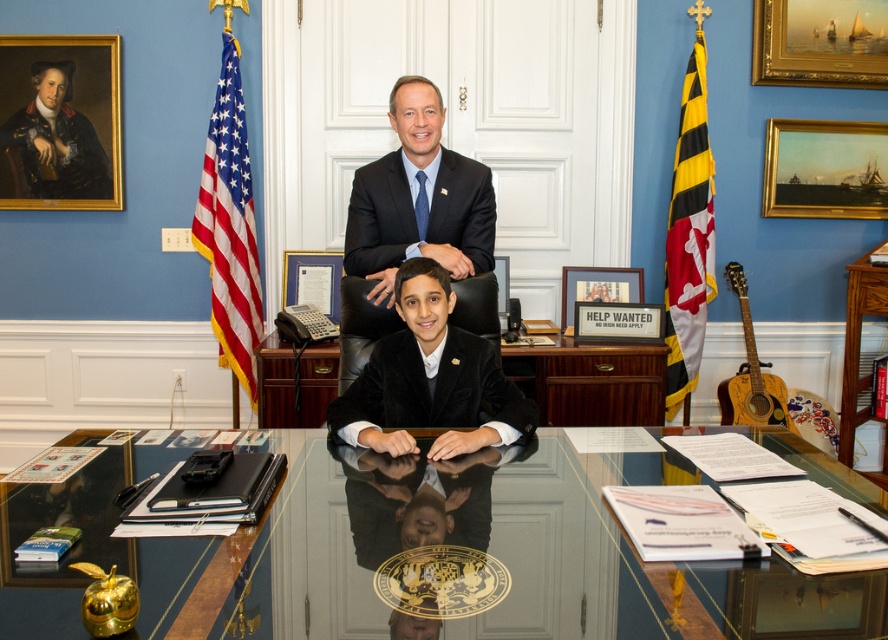
You are standing in the office shown in the image. If you want to place a new document on the glossy glass table at center, where exactly should you aim? Please provide the coordinates from the scene description.

The glossy glass table at center is located at coordinates point (x=401, y=550), so you should aim for that exact point to place the new document there.

You are an interior designer planning to place a new piece of furniture in this office. The black velvet suit at center and the oil painting ship at upper right are already present. Which object takes up more space in the office?

The black velvet suit at center takes up more space in the office as it is larger in size than the oil painting ship at upper right.

In the image of the formal office scene with two individuals seated at a large desk, where the black velvet suit at center is represented by point (433, 388), can you determine the spatial relationship between the black velvet suit at center and the Maryland State Government seal?

The Maryland State Government seal is located on the desk surface, while the black velvet suit at center is represented by point (433, 388), but no specific spatial details between them are provided in the description.